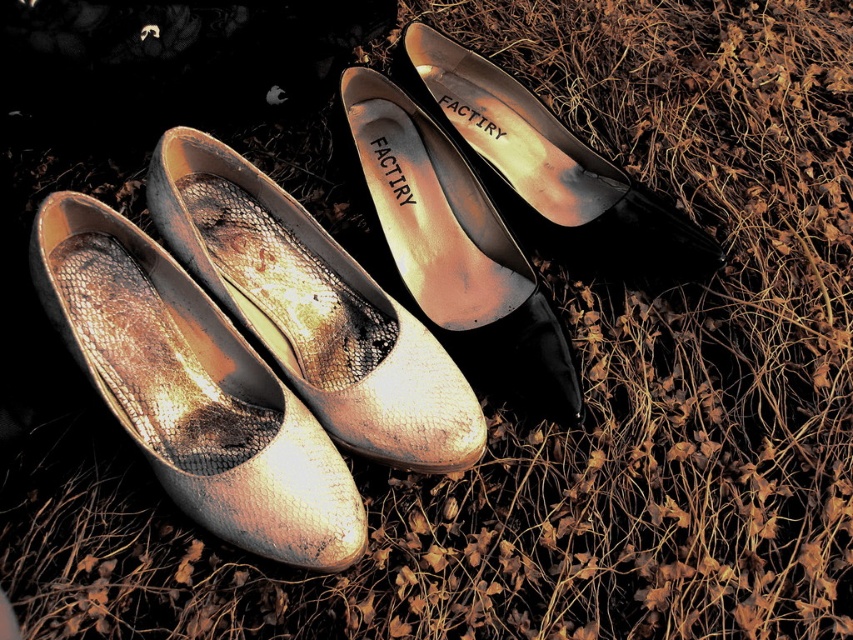
You are a shoe designer trying to fit a new pair of shoes into a display case. The display case has a width of 12 inches. You have two shoes to place inside the case. The first is the metallic gold shoe at center, and the second is the metallic leather shoe at center. Based on their widths, can both shoes fit side by side in the case?

The metallic gold shoe at center might be wider than the metallic leather shoe at center. Therefore, it is uncertain if both can fit side by side in the 12 inch wide display case without overlapping. Measure their actual widths to confirm.

You are a delivery person who needs to pack the metallic leather shoe at center and the metallic gold shoe at upper center into a box that is 6 inches wide. Can you fit both shoes side by side in the box?

The distance between the metallic leather shoe at center and the metallic gold shoe at upper center is 5.96 inches, so yes, both shoes can fit side by side in the 6 inch wide box since the combined width is less than the box width.